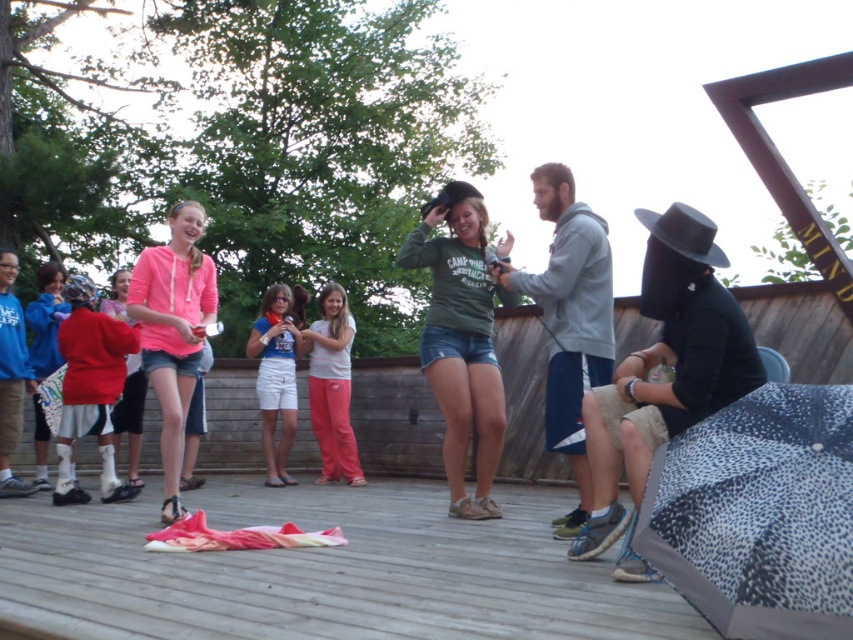
Question: Which object is the closest to the matte red hoodie at left?

Choices:
 (A) pink cotton hoodie at center
 (B) black felt cowboy hat at upper right
 (C) speckled fabric umbrella at lower right
 (D) matte red jacket at left

Answer: (D)

Question: Among these points, which one is farthest from the camera?

Choices:
 (A) (664, 216)
 (B) (259, 346)
 (C) (18, 493)

Answer: (B)

Question: From the image, what is the correct spatial relationship of green matte sweatshirt at center in relation to blue sweatshirt at left?

Choices:
 (A) above
 (B) below

Answer: (A)

Question: Does white cotton shorts at center appear under blue sweatshirt at left?

Choices:
 (A) no
 (B) yes

Answer: (B)

Question: Is speckled fabric umbrella at lower right thinner than green matte sweatshirt at center?

Choices:
 (A) yes
 (B) no

Answer: (A)

Question: Based on their relative distances, which object is nearer to the black felt cowboy hat at center?

Choices:
 (A) green matte sweatshirt at center
 (B) matte red jacket at left
 (C) pink cotton pants at center
 (D) wooden deck at center

Answer: (A)